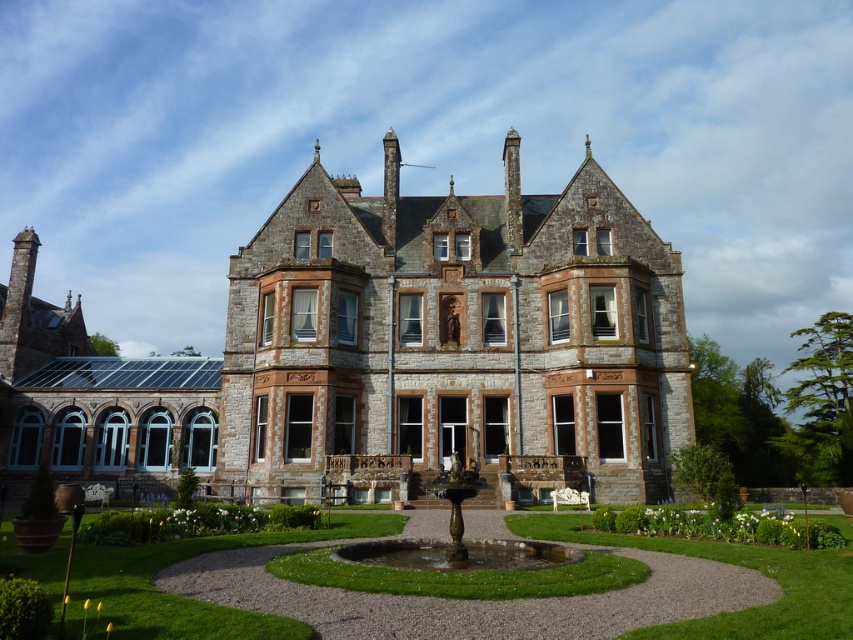
Question: Which point is farther from the camera taking this photo?

Choices:
 (A) (469, 566)
 (B) (685, 518)
 (C) (354, 230)

Answer: (C)

Question: Is green grass at center positioned before green grass at lower right?

Choices:
 (A) no
 (B) yes

Answer: (B)

Question: Which object is positioned farthest from the bronze metallic fountain at center?

Choices:
 (A) green grass at center
 (B) stone mansion at center

Answer: (B)

Question: Is green grass at center smaller than bronze metallic fountain at center?

Choices:
 (A) no
 (B) yes

Answer: (A)

Question: Based on their relative distances, which object is nearer to the green grass at center?

Choices:
 (A) stone mansion at center
 (B) green grass at lower right

Answer: (B)

Question: Considering the relative positions of green grass at center and bronze metallic fountain at center in the image provided, where is green grass at center located with respect to bronze metallic fountain at center?

Choices:
 (A) below
 (B) above

Answer: (A)